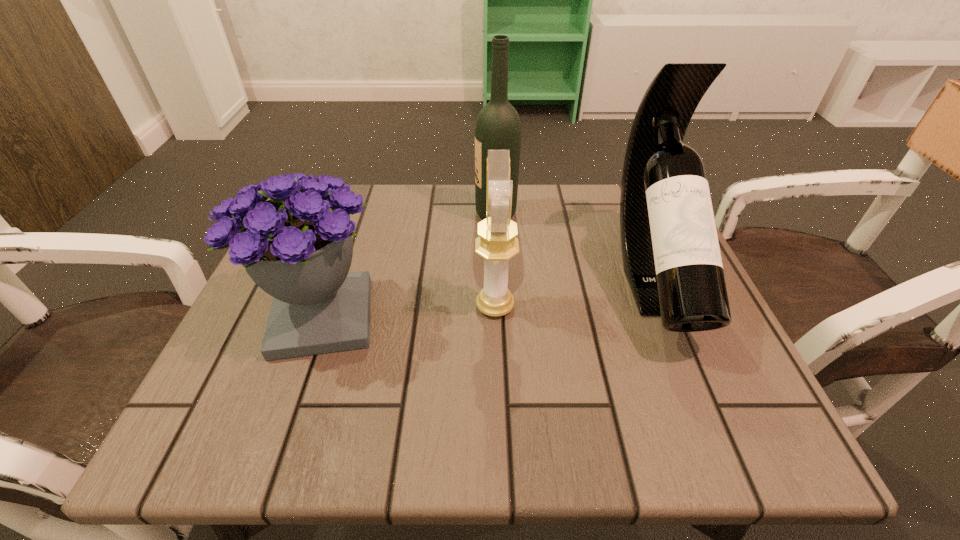
Where is `free space that satisfies the following two spatial constraints: 1. on the stand of the rightmost object; 2. on the front-facing side of the award`? The image size is (960, 540). free space that satisfies the following two spatial constraints: 1. on the stand of the rightmost object; 2. on the front-facing side of the award is located at coordinates (663, 306).

Identify the location of free location that satisfies the following two spatial constraints: 1. on the labeled side of the left wine bottle; 2. on the front side of the bouquet. This screenshot has width=960, height=540. (500, 318).